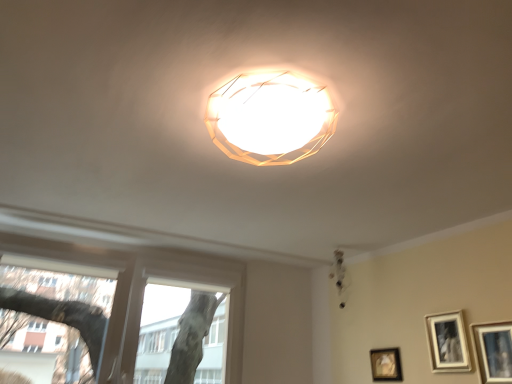
Question: From the image's perspective, would you say transparent glass window at lower left is shown under matte black picture frame at lower right, which is the 3th picture frame in back-to-front order?

Choices:
 (A) yes
 (B) no

Answer: (A)

Question: Does transparent glass window at lower left lie in front of matte black picture frame at lower right, which is the 3th picture frame in back-to-front order?

Choices:
 (A) yes
 (B) no

Answer: (B)

Question: Considering the relative sizes of transparent glass window at lower left and matte black picture frame at lower right, which is the 3th picture frame in back-to-front order, in the image provided, is transparent glass window at lower left smaller than matte black picture frame at lower right, which is the 3th picture frame in back-to-front order,?

Choices:
 (A) no
 (B) yes

Answer: (A)

Question: Is transparent glass window at lower left oriented towards matte black picture frame at lower right, arranged as the 3th picture frame when viewed from the left?

Choices:
 (A) yes
 (B) no

Answer: (B)

Question: From the image's perspective, does transparent glass window at lower left appear higher than matte black picture frame at lower right, which is the 3th picture frame in back-to-front order?

Choices:
 (A) yes
 (B) no

Answer: (B)

Question: From the image's perspective, is transparent glass window at lower left located above or below matte silver picture frame at lower right, the 2th picture frame when ordered from left to right?

Choices:
 (A) below
 (B) above

Answer: (A)

Question: Is point (147, 327) closer or farther from the camera than point (464, 344)?

Choices:
 (A) farther
 (B) closer

Answer: (A)

Question: From a real-world perspective, is transparent glass window at lower left physically located above or below matte silver picture frame at lower right, which is counted as the 2th picture frame, starting from the front?

Choices:
 (A) below
 (B) above

Answer: (B)

Question: Is transparent glass window at lower left in front of or behind matte silver picture frame at lower right, which is the 2th picture frame in right-to-left order, in the image?

Choices:
 (A) behind
 (B) front

Answer: (A)

Question: Considering the positions of matte black picture frame at lower right, which appears as the 1th picture frame when viewed from the back, and matte white chandelier at upper center in the image, is matte black picture frame at lower right, which appears as the 1th picture frame when viewed from the back, wider or thinner than matte white chandelier at upper center?

Choices:
 (A) thin
 (B) wide

Answer: (A)

Question: Is matte black picture frame at lower right, the 3th picture frame from the front, bigger or smaller than matte white chandelier at upper center?

Choices:
 (A) small
 (B) big

Answer: (A)

Question: Does point (378, 364) appear closer or farther from the camera than point (344, 269)?

Choices:
 (A) closer
 (B) farther

Answer: (A)

Question: From the image's perspective, is matte black picture frame at lower right, which ranks as the third picture frame in right-to-left order, above or below matte white chandelier at upper center?

Choices:
 (A) above
 (B) below

Answer: (B)

Question: Considering the positions of matte black picture frame at lower right, positioned as the 1th picture frame in front-to-back order, and matte white chandelier at upper center in the image, is matte black picture frame at lower right, positioned as the 1th picture frame in front-to-back order, wider or thinner than matte white chandelier at upper center?

Choices:
 (A) wide
 (B) thin

Answer: (B)

Question: From a real-world perspective, is matte black picture frame at lower right, arranged as the 3th picture frame when viewed from the left, positioned above or below matte white chandelier at upper center?

Choices:
 (A) below
 (B) above

Answer: (A)